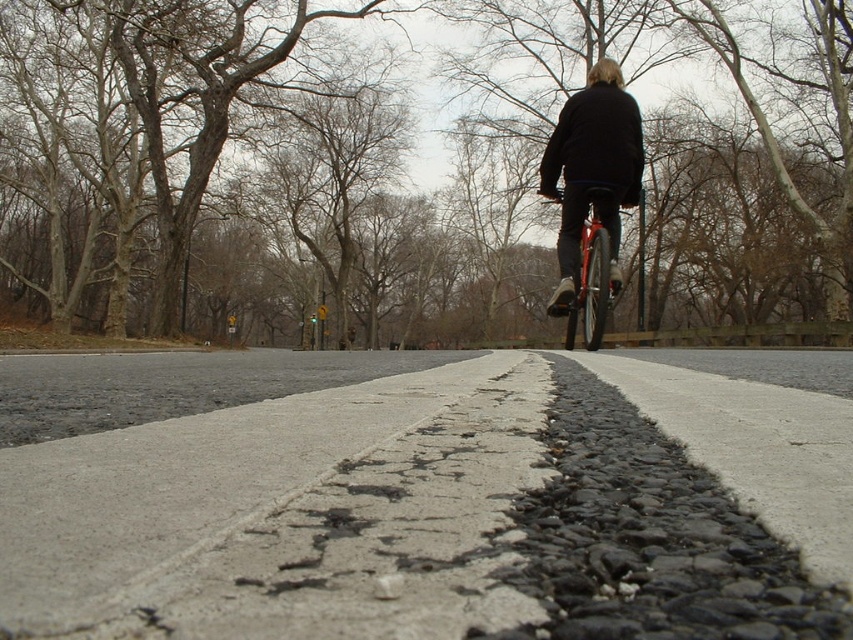
You are a pedestrian walking on the asphalt at center and see the shiny red bicycle at center. Which object is closer to the ground?

The asphalt at center is closer to the ground because it is below the shiny red bicycle at center.

You are a delivery person who needs to place a package on the ground between the asphalt at center and the shiny red bicycle at center. Which object should you place the package closer to so that it doesn

The asphalt at center is shorter than the shiny red bicycle at center, so you should place the package closer to the shiny red bicycle at center to ensure there is enough space.